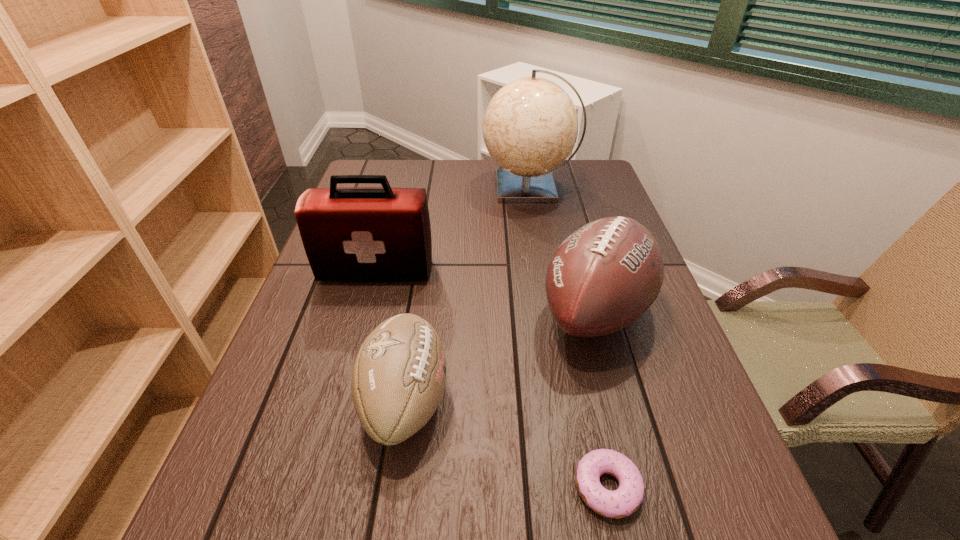
I want to click on free space located 0.120m on the surface of the tallest object showing Europe and Africa, so click(444, 187).

Where is `free space located on the side of the first aid kit with the cross symbol`? Image resolution: width=960 pixels, height=540 pixels. free space located on the side of the first aid kit with the cross symbol is located at coordinates (346, 384).

This screenshot has height=540, width=960. I want to click on free spot located on the left of the right football (American), so coord(512,312).

This screenshot has height=540, width=960. In order to click on free region located 0.290m on the laces of the left football (American) in this screenshot , I will do `click(604, 400)`.

Find the location of `vacant area located 0.310m on the left of the shortest object`. vacant area located 0.310m on the left of the shortest object is located at coordinates pos(379,487).

This screenshot has width=960, height=540. Identify the location of object positioned at the far edge. (530, 127).

Identify the location of object that is at the left edge. This screenshot has height=540, width=960. (350, 234).

At what (x,y) coordinates should I click in order to perform the action: click on globe at the right edge. Please return your answer as a coordinate pair (x, y). This screenshot has width=960, height=540. Looking at the image, I should click on click(530, 127).

At what (x,y) coordinates should I click in order to perform the action: click on football (American) that is at the right edge. Please return your answer as a coordinate pair (x, y). Looking at the image, I should click on (605, 275).

The height and width of the screenshot is (540, 960). What are the coordinates of `doughnut that is at the right edge` in the screenshot? It's located at (624, 501).